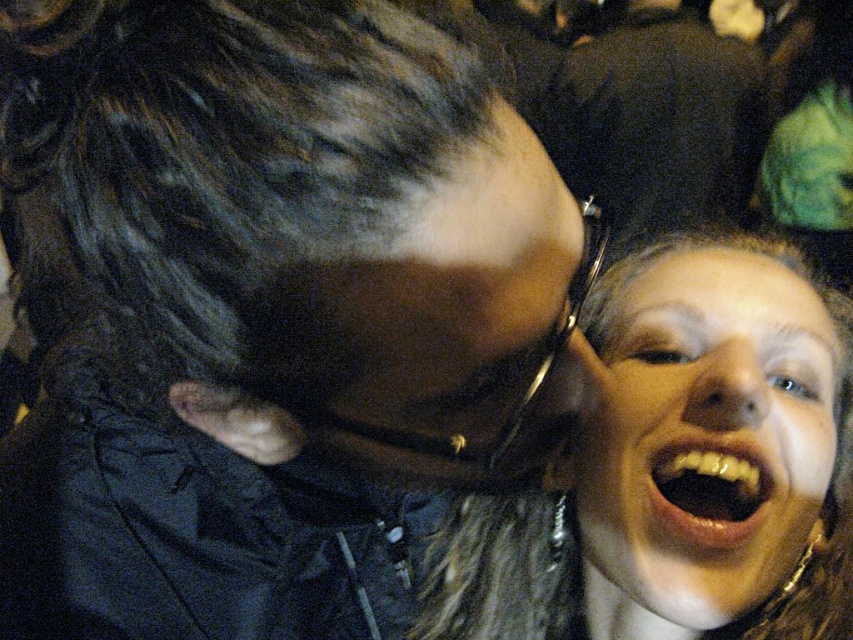
Does black matte hair at upper left have a lesser height compared to black plastic goggles at center?

No.

Is point (241, 80) behind point (587, 269)?

No, it is in front of (587, 269).

The width and height of the screenshot is (853, 640). I want to click on black matte hair at upper left, so click(270, 312).

Does black matte hair at upper left have a greater height compared to smooth glossy teeth at lower right?

Yes.

Is point (212, 538) positioned after point (675, 480)?

Yes, it is behind point (675, 480).

Find the location of `black matte hair at upper left`. black matte hair at upper left is located at coordinates (270, 312).

Based on the photo, measure the distance from smooth skin face at lower right to black plastic goggles at center.

smooth skin face at lower right is 21.03 centimeters from black plastic goggles at center.

Does smooth skin face at lower right appear over black plastic goggles at center?

No, smooth skin face at lower right is not above black plastic goggles at center.

Is point (791, 346) closer to camera compared to point (421, 442)?

No, (791, 346) is behind (421, 442).

You are a GUI agent. You are given a task and a screenshot of the screen. Output one action in this format:
    pyautogui.click(x=<x>, y=<y>)
    Task: Click on the smooth skin face at lower right
    
    Given the screenshot: What is the action you would take?
    pyautogui.click(x=706, y=440)